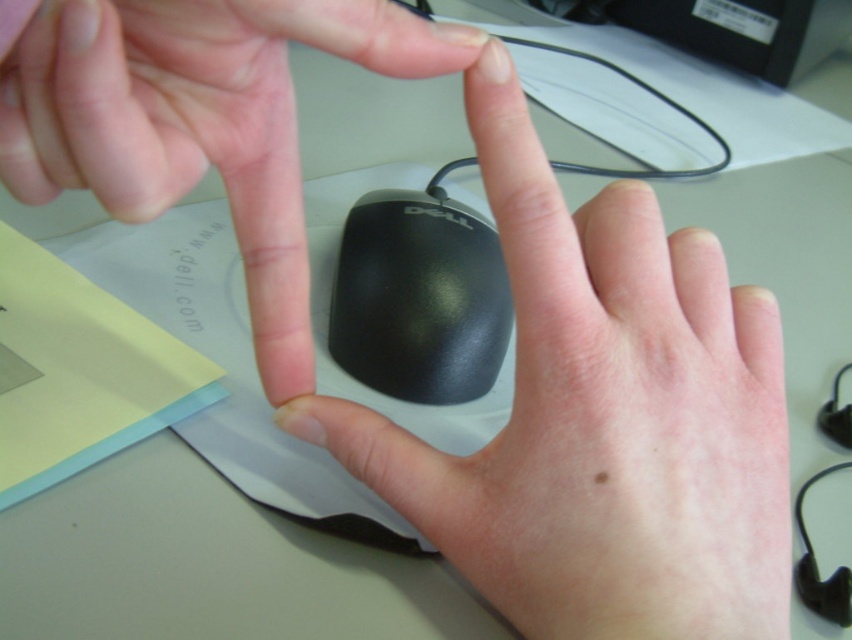
Question: Where is matte black mouse at center located in relation to black glossy mouse at center in the image?

Choices:
 (A) left
 (B) right

Answer: (A)

Question: Is smooth skin hand at center thinner than matte black mouse at center?

Choices:
 (A) no
 (B) yes

Answer: (A)

Question: Which point is farther to the camera?

Choices:
 (A) (240, 88)
 (B) (344, 355)

Answer: (B)

Question: Does smooth skin hand at center come in front of black glossy mouse at center?

Choices:
 (A) no
 (B) yes

Answer: (B)

Question: Which point is closer to the camera taking this photo?

Choices:
 (A) (686, 545)
 (B) (485, 296)

Answer: (A)

Question: Which object is the closest to the black glossy mouse at center?

Choices:
 (A) matte black mouse at center
 (B) smooth skin hand at center

Answer: (B)